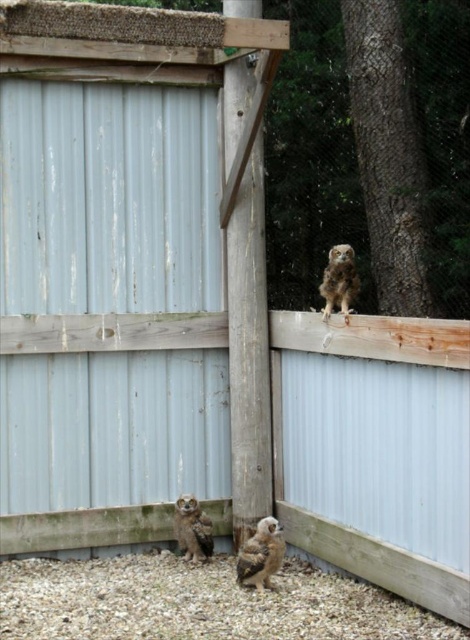
Based on the photo, is brown gravel at lower center smaller than brown fuzzy owl at lower center?

Incorrect, brown gravel at lower center is not smaller in size than brown fuzzy owl at lower center.

From the picture: How distant is brown gravel at lower center from brown fuzzy owl at lower center?

brown gravel at lower center and brown fuzzy owl at lower center are 18.84 inches apart from each other.

The image size is (470, 640). What do you see at coordinates (197, 602) in the screenshot? I see `brown gravel at lower center` at bounding box center [197, 602].

Image resolution: width=470 pixels, height=640 pixels. What are the coordinates of `brown gravel at lower center` in the screenshot? It's located at (197, 602).

Between brown speckled feathers owl at lower center and brown fuzzy owl at lower center, which one has more height?

With more height is brown fuzzy owl at lower center.

The width and height of the screenshot is (470, 640). What do you see at coordinates (260, 554) in the screenshot?
I see `brown speckled feathers owl at lower center` at bounding box center [260, 554].

Find the location of a particular element. This screenshot has width=470, height=640. brown speckled feathers owl at lower center is located at coordinates (260, 554).

Does brown gravel at lower center come behind brown speckled feathers at upper right?

No, it is in front of brown speckled feathers at upper right.

Where is `brown gravel at lower center`? The image size is (470, 640). brown gravel at lower center is located at coordinates (197, 602).